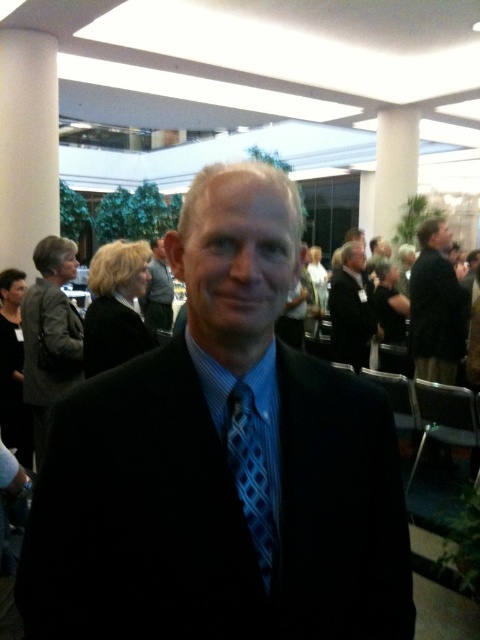
You are a photographer at a formal event. You need to capture a clear photo of the black silk suit at center without the black suit at center blocking it. Can you do this?

The black silk suit at center is in front of the black suit at center, so you can capture a clear photo of the black silk suit at center without the black suit at center blocking it.

Looking at this image, you are a photographer at a formal event. You need to capture a group photo of the black silk suit at center and the black suit at right. The camera you have can only focus on subjects within a 3 meter range. Will both subjects be in focus?

The black silk suit at center and the black suit at right are 3.18 meters apart. Since the camera can only focus within 3 meters, the distance between them exceeds the focus range. Therefore, both subjects cannot be in focus simultaneously.

You are an event planner trying to place a 1.2 meter wide banner on the wall directly behind the black silk suit at center. Given the coordinates of the suit, can you estimate if there is enough space to place the banner without overlapping any other objects?

The coordinates of the black silk suit at center are at point (222,461). However, without additional information about the dimensions of the wall or the placement of other objects around that area, it is impossible to accurately determine if there is sufficient space to place the 1.2 meter wide banner without overlapping anything. Further details about the room layout and object placements are needed to provide a precise answer.